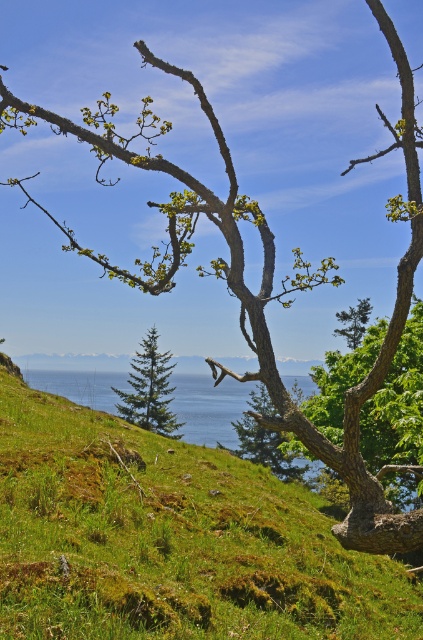
From the picture: Who is more distant from viewer, (222, 428) or (257, 440)?

The point (222, 428) is more distant.

Consider the image. How far apart are blue water at center and green leafy tree at center?

blue water at center is 9.04 feet away from green leafy tree at center.

Is point (41, 381) farther from viewer compared to point (257, 426)?

Yes, point (41, 381) is farther from viewer.

Locate an element on the screen. blue water at center is located at coordinates (208, 406).

Between green mossy hillside at center and green leafy tree at center, which one is positioned lower?

green leafy tree at center is lower down.

Who is more distant from viewer, (x=88, y=476) or (x=247, y=456)?

Positioned behind is point (x=247, y=456).

Locate an element on the screen. green mossy hillside at center is located at coordinates tap(170, 540).

Is the position of green matte evergreen tree at center more distant than that of green matte tree at center?

No, it is in front of green matte tree at center.

Find the location of `green matte evergreen tree at center`. green matte evergreen tree at center is located at coordinates (150, 388).